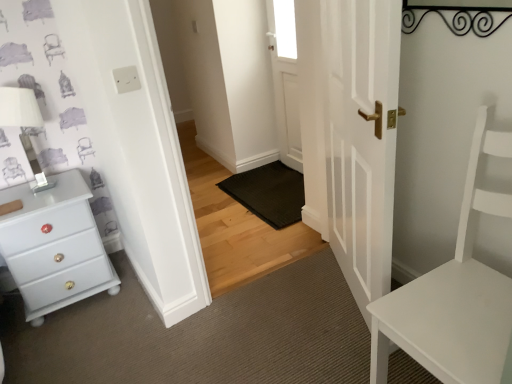
What is the approximate height of matte white chest of drawers at left?

matte white chest of drawers at left is 23.27 inches tall.

Locate an element on the screen. This screenshot has height=384, width=512. white glossy door at center, the 1th door positioned from the front is located at coordinates (351, 133).

From a real-world perspective, which object rests below the other?

In real-world perspective, white wooden door at center, placed as the 2th door when sorted from front to back, is lower.

Does white wooden door at center, placed as the 2th door when sorted from front to back, have a lesser width compared to transparent glass window at upper center?

No, white wooden door at center, placed as the 2th door when sorted from front to back, is not thinner than transparent glass window at upper center.

Is white wooden door at center, placed as the 2th door when sorted from front to back, taller than transparent glass window at upper center?

Yes, white wooden door at center, placed as the 2th door when sorted from front to back, is taller than transparent glass window at upper center.

Is white wooden door at center, placed as the 2th door when sorted from front to back, oriented towards transparent glass window at upper center?

Yes, white wooden door at center, placed as the 2th door when sorted from front to back, faces towards transparent glass window at upper center.

Which of these two, transparent glass window at upper center or matte white chest of drawers at left, stands taller?

Standing taller between the two is matte white chest of drawers at left.

Which object is positioned more to the left, transparent glass window at upper center or matte white chest of drawers at left?

matte white chest of drawers at left is more to the left.

What's the angular difference between transparent glass window at upper center and matte white chest of drawers at left's facing directions?

The angle between the facing direction of transparent glass window at upper center and the facing direction of matte white chest of drawers at left is 87.6 degrees.

From a real-world perspective, does transparent glass window at upper center sit lower than matte white chest of drawers at left?

No, from a real-world perspective, transparent glass window at upper center is not under matte white chest of drawers at left.

Is white matte chair at right facing away from white wooden door at center, placed as the 2th door when sorted from front to back?

white matte chair at right is not turned away from white wooden door at center, placed as the 2th door when sorted from front to back.

From a real-world perspective, does white matte chair at right stand above white wooden door at center, placed as the 2th door when sorted from front to back?

No, from a real-world perspective, white matte chair at right is not on top of white wooden door at center, placed as the 2th door when sorted from front to back.

Can you confirm if white matte chair at right is positioned to the left of white wooden door at center, placed as the 2th door when sorted from front to back?

In fact, white matte chair at right is to the right of white wooden door at center, placed as the 2th door when sorted from front to back.

Is white matte chair at right with white wooden door at center, placed as the 2th door when sorted from front to back?

No, white matte chair at right is not with white wooden door at center, placed as the 2th door when sorted from front to back.

Who is bigger, black rubber doormat at center or white wooden door at center, placed as the 2th door when sorted from front to back?

With larger size is black rubber doormat at center.

Relative to white wooden door at center, which is the 1th door in back-to-front order, is black rubber doormat at center in front or behind?

black rubber doormat at center is positioned closer to the viewer than white wooden door at center, which is the 1th door in back-to-front order.

Is black rubber doormat at center inside the boundaries of white wooden door at center, placed as the 2th door when sorted from front to back, or outside?

black rubber doormat at center lies outside white wooden door at center, placed as the 2th door when sorted from front to back.

Is black rubber doormat at center touching white wooden door at center, which is the 1th door in back-to-front order?

black rubber doormat at center and white wooden door at center, which is the 1th door in back-to-front order, are clearly separated.

Can you tell me how much transparent glass window at upper center and white wooden door at center, placed as the 2th door when sorted from front to back, differ in facing direction?

0.0384 degrees separate the facing orientations of transparent glass window at upper center and white wooden door at center, placed as the 2th door when sorted from front to back.

Looking at this image, is transparent glass window at upper center wider or thinner than white wooden door at center, which is the 1th door in back-to-front order?

In the image, transparent glass window at upper center appears to be more narrow than white wooden door at center, which is the 1th door in back-to-front order.

From a real-world perspective, is transparent glass window at upper center on top of white wooden door at center, placed as the 2th door when sorted from front to back?

Yes.

Does point (294, 40) come farther from viewer compared to point (283, 91)?

No, (294, 40) is closer to viewer.

Considering the relative sizes of black rubber doormat at center and white glossy door at center, positioned as the 2th door in back-to-front order, in the image provided, is black rubber doormat at center shorter than white glossy door at center, positioned as the 2th door in back-to-front order,?

Yes, black rubber doormat at center is shorter than white glossy door at center, positioned as the 2th door in back-to-front order.

Considering the positions of points (252, 174) and (385, 151), is point (252, 174) farther from camera compared to point (385, 151)?

Yes, point (252, 174) is farther from viewer.

Is black rubber doormat at center next to white glossy door at center, positioned as the 2th door in back-to-front order, and touching it?

No, black rubber doormat at center is not making contact with white glossy door at center, positioned as the 2th door in back-to-front order.

Is black rubber doormat at center smaller than white glossy door at center, positioned as the 2th door in back-to-front order?

Indeed, black rubber doormat at center has a smaller size compared to white glossy door at center, positioned as the 2th door in back-to-front order.

The height and width of the screenshot is (384, 512). Find the location of `the 2nd door behind when counting from the white matte chair at right`. the 2nd door behind when counting from the white matte chair at right is located at coordinates (285, 79).

Is white wooden door at center, placed as the 2th door when sorted from front to back, with white matte chair at right?

No, white wooden door at center, placed as the 2th door when sorted from front to back, is not next to white matte chair at right.

Between white wooden door at center, placed as the 2th door when sorted from front to back, and white matte chair at right, which one has larger size?

With larger size is white matte chair at right.

Which of these two, white wooden door at center, placed as the 2th door when sorted from front to back, or white matte chair at right, is thinner?

white wooden door at center, placed as the 2th door when sorted from front to back, is thinner.

Locate an element on the screen. The width and height of the screenshot is (512, 384). window that is in front of the white wooden door at center, placed as the 2th door when sorted from front to back is located at coordinates (285, 28).

Where is `chest of drawers below the transparent glass window at upper center (from the image's perspective)`? chest of drawers below the transparent glass window at upper center (from the image's perspective) is located at coordinates (55, 246).

Estimate the real-world distances between objects in this image. Which object is further from matte white chest of drawers at left, white matte chair at right or transparent glass window at upper center?

transparent glass window at upper center.

Estimate the real-world distances between objects in this image. Which object is further from white wooden door at center, placed as the 2th door when sorted from front to back, transparent glass window at upper center or black rubber doormat at center?

The object further to white wooden door at center, placed as the 2th door when sorted from front to back, is black rubber doormat at center.

Considering their positions, is white matte chair at right positioned closer to white wooden door at center, which is the 1th door in back-to-front order, than transparent glass window at upper center?

transparent glass window at upper center lies closer to white wooden door at center, which is the 1th door in back-to-front order, than the other object.

Looking at the image, which one is located closer to white glossy door at center, the 1th door positioned from the front, matte white chest of drawers at left or white matte chair at right?

Among the two, white matte chair at right is located nearer to white glossy door at center, the 1th door positioned from the front.

Looking at the image, which one is located closer to matte white chest of drawers at left, transparent glass window at upper center or white matte chair at right?

The object closer to matte white chest of drawers at left is white matte chair at right.

From the image, which object appears to be farther from black rubber doormat at center, white glossy door at center, the 1th door positioned from the front, or matte white chest of drawers at left?

matte white chest of drawers at left is further to black rubber doormat at center.

Which object lies further to the anchor point matte white chest of drawers at left, white wooden door at center, placed as the 2th door when sorted from front to back, or white matte chair at right?

white wooden door at center, placed as the 2th door when sorted from front to back, is further to matte white chest of drawers at left.

Based on their spatial positions, is white glossy door at center, the 1th door positioned from the front, or black rubber doormat at center closer to white wooden door at center, which is the 1th door in back-to-front order?

black rubber doormat at center.

Find the location of a particular element. Image resolution: width=512 pixels, height=384 pixels. doormat between transparent glass window at upper center and matte white chest of drawers at left from top to bottom is located at coordinates (269, 193).

I want to click on door between white matte chair at right and transparent glass window at upper center along the z-axis, so click(x=351, y=133).

I want to click on window between matte white chest of drawers at left and white wooden door at center, placed as the 2th door when sorted from front to back, from left to right, so click(285, 28).

This screenshot has width=512, height=384. In order to click on chest of drawers between white glossy door at center, positioned as the 2th door in back-to-front order, and white wooden door at center, which is the 1th door in back-to-front order, in the front-back direction in this screenshot , I will do `click(55, 246)`.